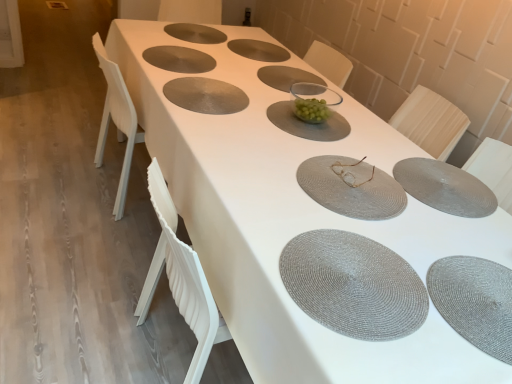
The height and width of the screenshot is (384, 512). I want to click on vacant area that lies between gray woven placemat at center and matte gray placemat at center, which is counted as the third tableware, starting from the bottom, so click(337, 213).